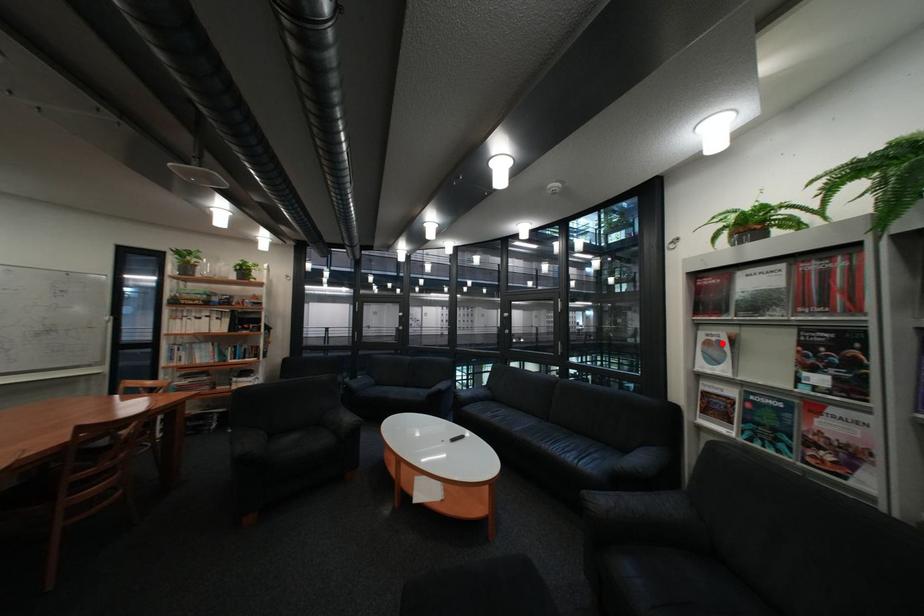
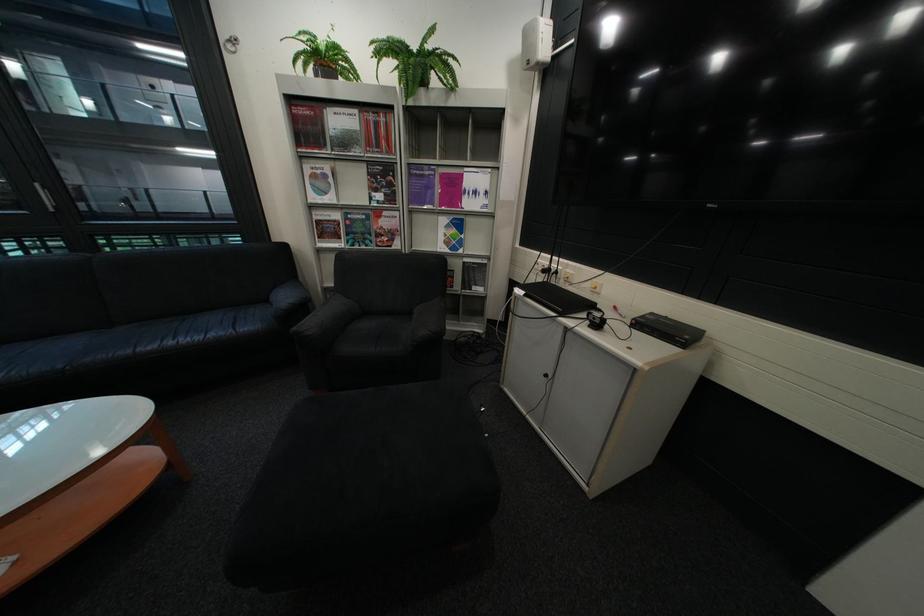
Question: A red point is marked in image1. In image2, is the corresponding 3D point closer to the camera or farther? Reply with the corresponding letter.

Choices:
 (A) The corresponding 3D point is closer.
 (B) The corresponding 3D point is farther.

Answer: (A)